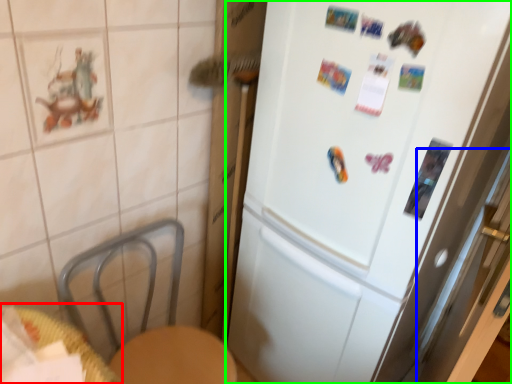
Question: Estimate the real-world distances between objects in this image. Which object is farther from table (highlighted by a red box), screen door (highlighted by a blue box) or refrigerator (highlighted by a green box)?

Choices:
 (A) screen door
 (B) refrigerator

Answer: (A)